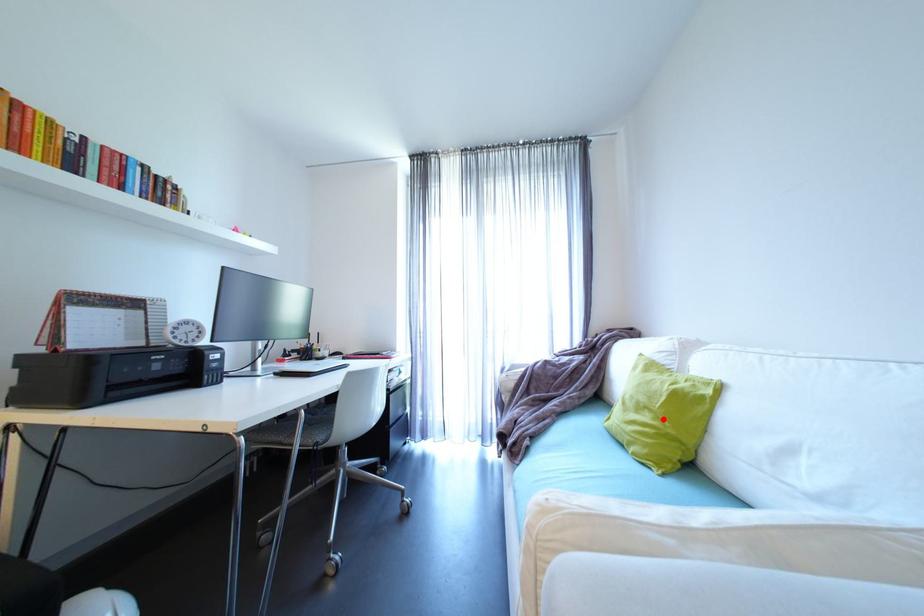
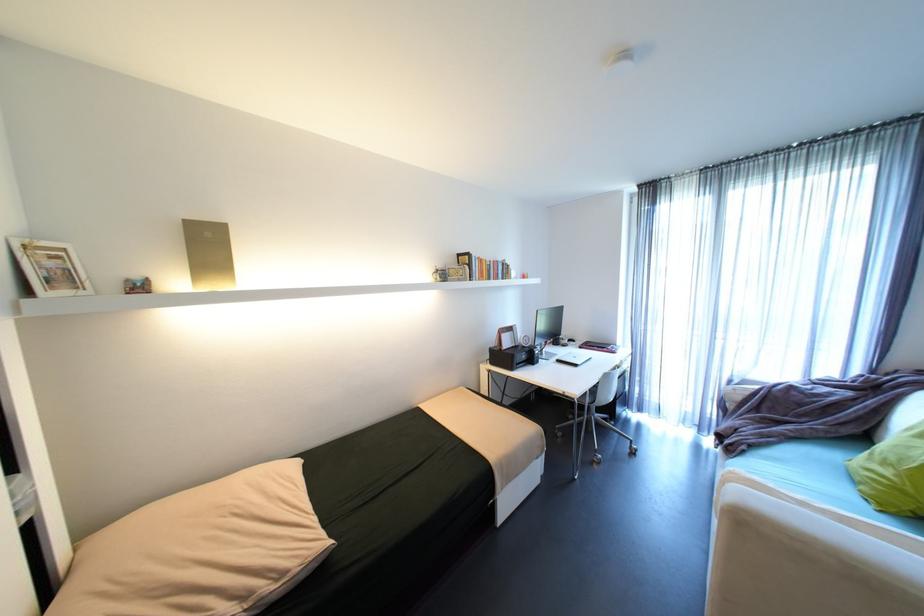
The point at the highlighted location is marked in the first image. Where is the corresponding point in the second image?

(906, 476)